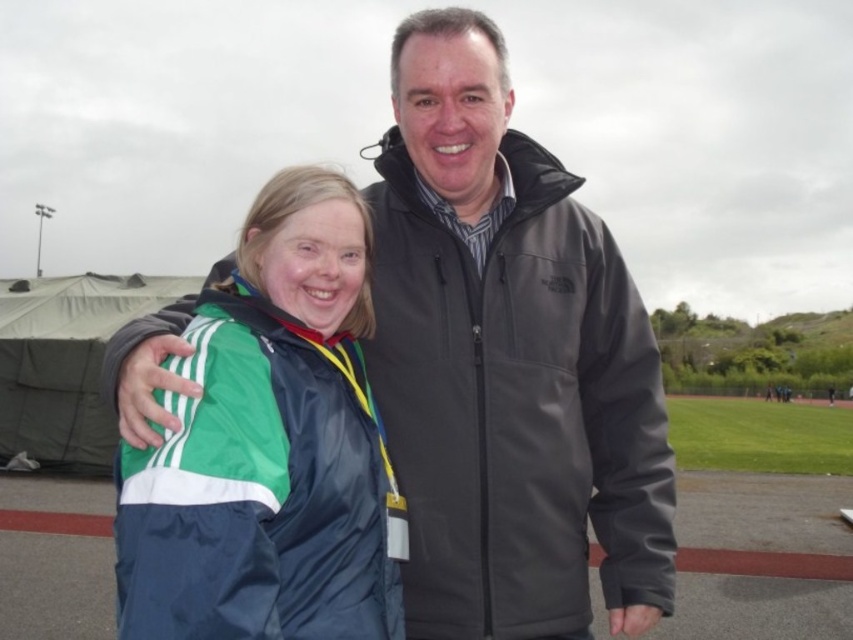
You are a photographer positioned at the dark gray softshell jacket at center. You want to take a photo of the green fabric tent at left. If your camera has a maximum zoom range of 50 feet, will you be able to capture the tent clearly without moving closer?

The distance between the dark gray softshell jacket at center and the green fabric tent at left is 48.76 feet, which is within the camera maximum zoom range of 50 feet. Therefore, you can capture the tent clearly without moving closer.